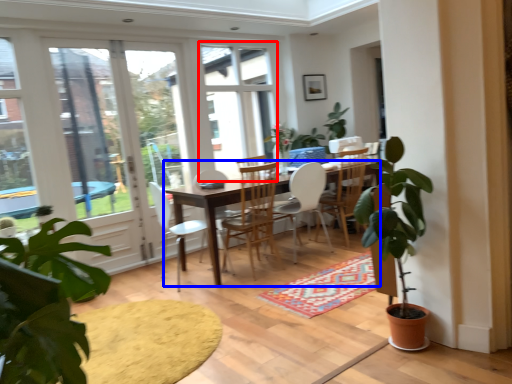
Question: Which point is closer to the camera, window (highlighted by a red box) or desk (highlighted by a blue box)?

Choices:
 (A) window
 (B) desk

Answer: (B)